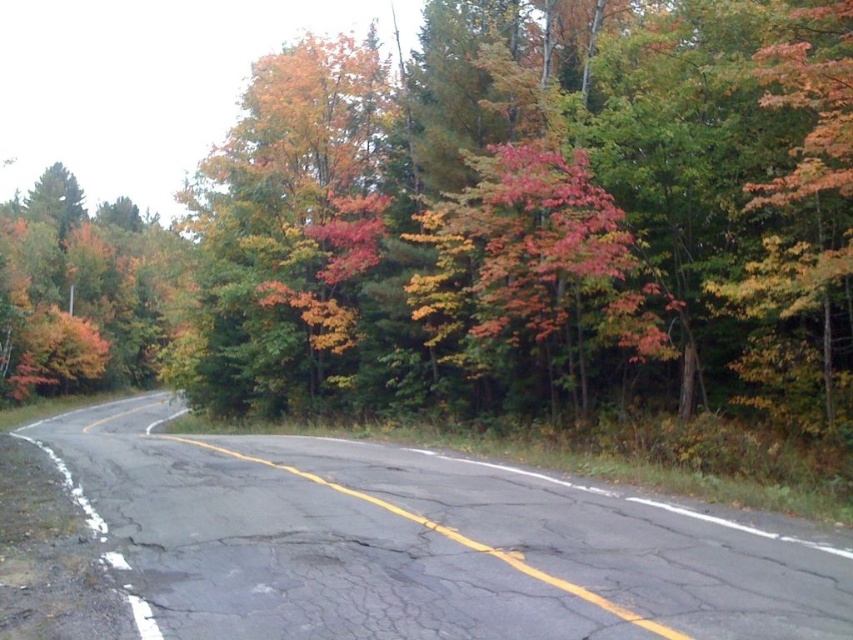
Based on the photo, who is more forward, (602, 56) or (227, 282)?

Positioned in front is point (602, 56).

Which is above, autumn foliage at center or autumn leaves at center?

Positioned higher is autumn leaves at center.

Which is in front, point (364, 356) or point (349, 42)?

Point (364, 356)

The width and height of the screenshot is (853, 640). I want to click on autumn foliage at center, so click(485, 230).